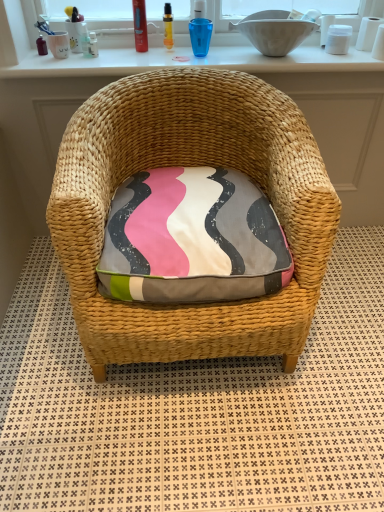
The image size is (384, 512). I want to click on free space to the left of translucent plastic toothbrush at upper center, the 1th toiletry from the left, so click(x=43, y=60).